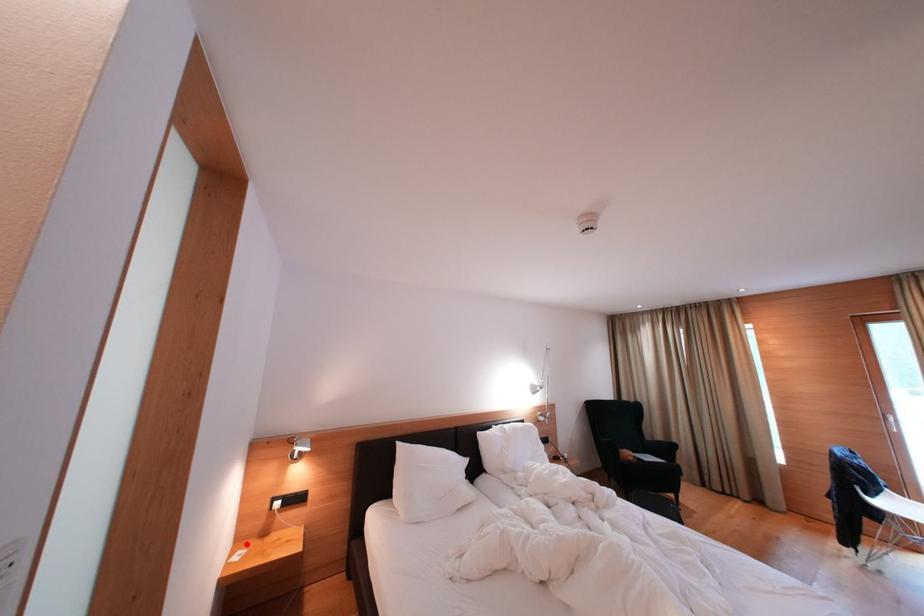
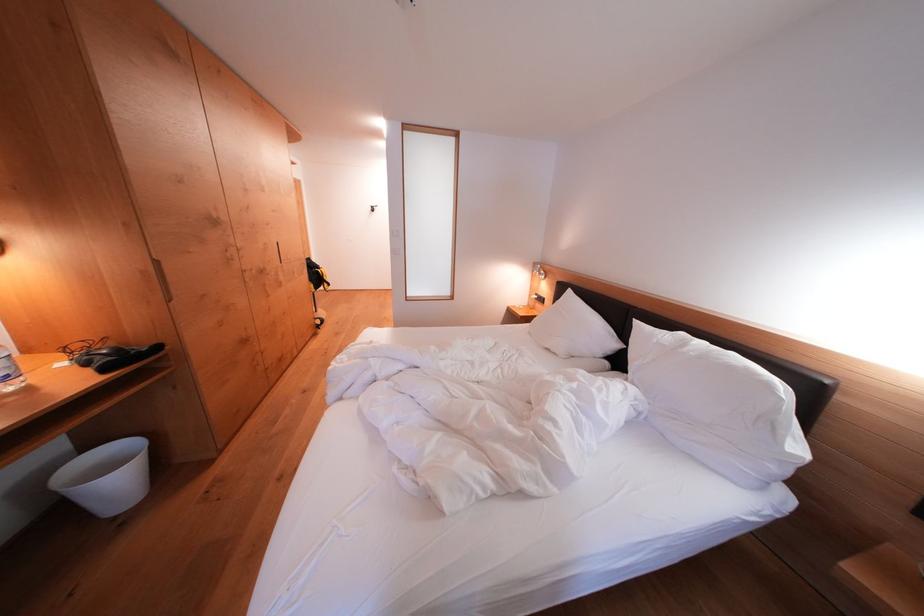
In the second image, find the point that corresponds to the highlighted location in the first image.

(536, 310)